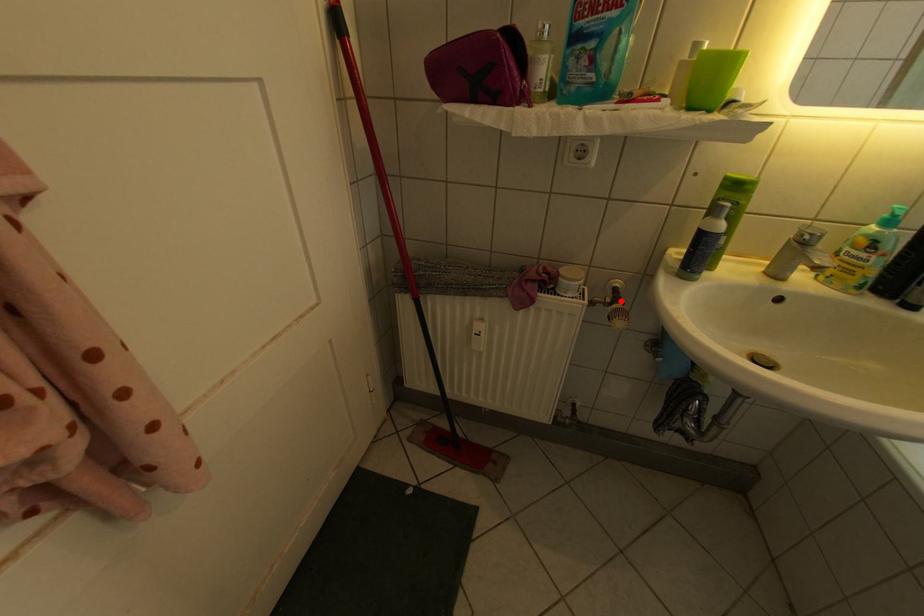
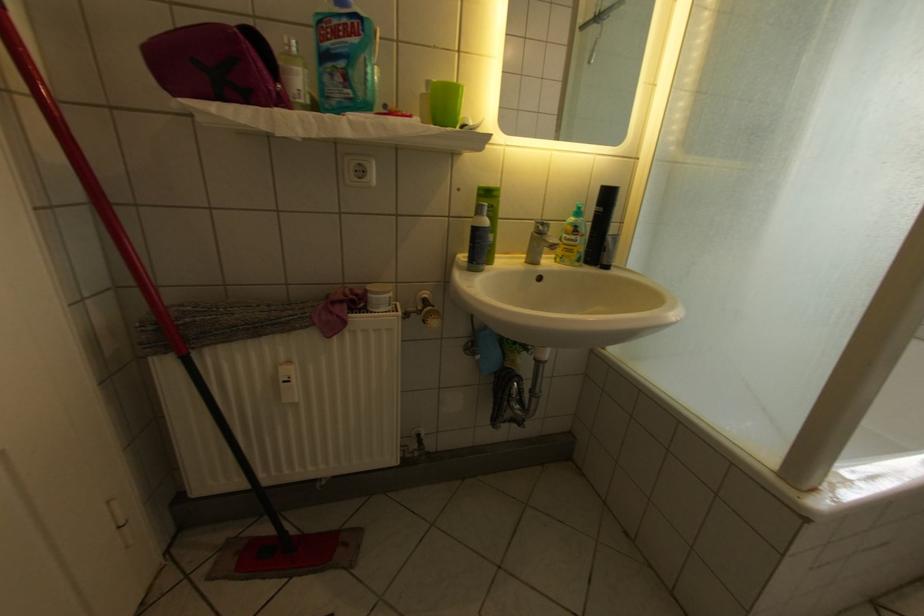
Locate, in the second image, the point that corresponds to the highlighted location in the first image.

(432, 309)